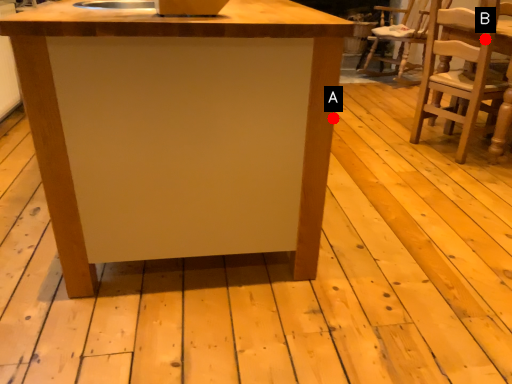
Question: Two points are circled on the image, labeled by A and B beside each circle. Among these points, which one is nearest to the camera?

Choices:
 (A) A is closer
 (B) B is closer

Answer: (A)